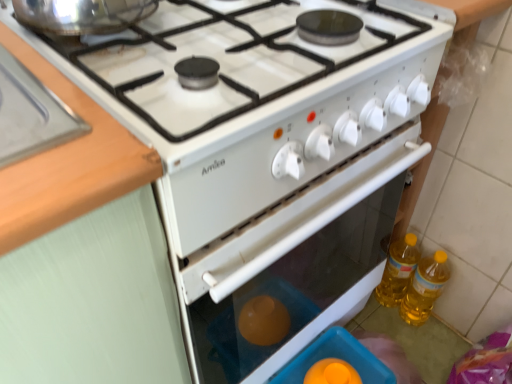
Question: Would you say wooden at left is to the left or to the right of translucent plastic container at lower center in the picture?

Choices:
 (A) left
 (B) right

Answer: (A)

Question: From a real-world perspective, is wooden at left physically located above or below translucent plastic container at lower center?

Choices:
 (A) below
 (B) above

Answer: (B)

Question: Estimate the real-world distances between objects in this image. Which object is farther from the translucent plastic container at lower center?

Choices:
 (A) yellow translucent bottle at right, which appears as the 1th bottle when viewed from the left
 (B) wooden at left
 (C) yellow translucent bottle at lower right, acting as the second bottle starting from the left

Answer: (B)

Question: Which of these objects is positioned closest to the yellow translucent bottle at lower right, acting as the first bottle starting from the right?

Choices:
 (A) yellow translucent bottle at right, which appears as the 1th bottle when viewed from the left
 (B) wooden at left
 (C) translucent plastic container at lower center

Answer: (A)